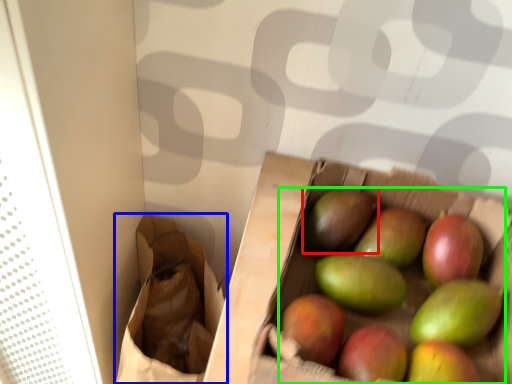
Question: Estimate the real-world distances between objects in this image. Which object is farther from mango (highlighted by a red box), shopping bag (highlighted by a blue box) or grapefruit (highlighted by a green box)?

Choices:
 (A) shopping bag
 (B) grapefruit

Answer: (A)